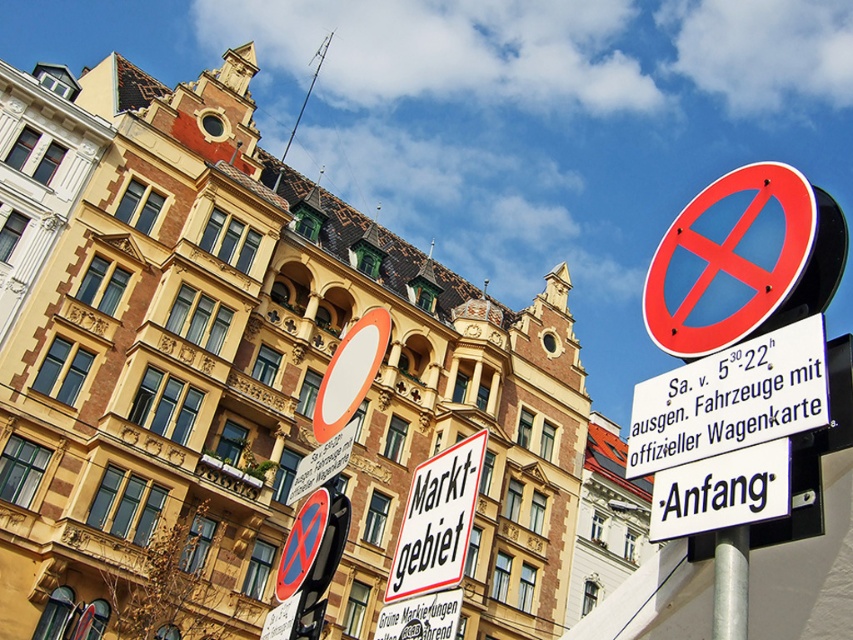
Question: Which point is closer to the camera?

Choices:
 (A) [480, 451]
 (B) [741, 608]

Answer: (B)

Question: Which point is closer to the camera?

Choices:
 (A) silver metallic pole at lower right
 (B) white paper sign at center

Answer: (A)

Question: Can you confirm if white paper sign at center is positioned to the right of silver metallic pole at lower right?

Choices:
 (A) no
 (B) yes

Answer: (A)

Question: Does white paper sign at center lie in front of silver metallic pole at lower right?

Choices:
 (A) yes
 (B) no

Answer: (B)

Question: Does white paper sign at center appear over silver metallic pole at lower right?

Choices:
 (A) yes
 (B) no

Answer: (B)

Question: Which of the following is the closest to the observer?

Choices:
 (A) white paper sign at center
 (B) silver metallic pole at lower right

Answer: (B)